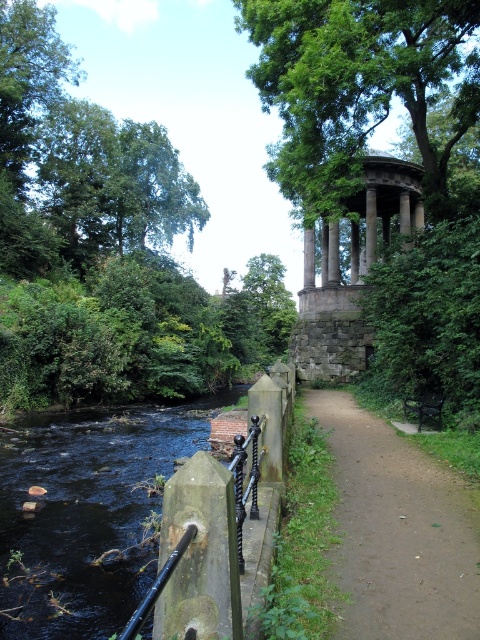
Question: Is green leafy tree at upper left smaller than black wrought iron rail at lower left?

Choices:
 (A) no
 (B) yes

Answer: (A)

Question: Can you confirm if white stone gazebo at center is positioned to the right of black metal rail at lower left?

Choices:
 (A) no
 (B) yes

Answer: (B)

Question: Can you confirm if green mossy post at center is positioned below black metal rail at lower left?

Choices:
 (A) yes
 (B) no

Answer: (B)

Question: Which is nearer to the green leafy tree at upper left?

Choices:
 (A) black metal rail at lower left
 (B) green mossy post at center
 (C) white stone gazebo at center
 (D) brown dirt path at center

Answer: (C)

Question: Among these objects, which one is nearest to the camera?

Choices:
 (A) black metal rail at lower left
 (B) green mossy post at center

Answer: (A)

Question: Which object is farther from the camera taking this photo?

Choices:
 (A) brown dirt path at center
 (B) green mossy post at center
 (C) white stone gazebo at center

Answer: (C)